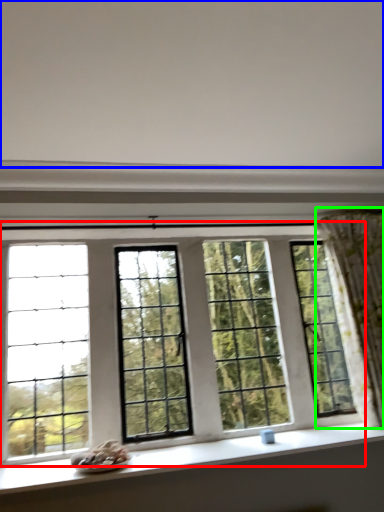
Question: Considering the real-world distances, which object is closest to window (highlighted by a red box)? backdrop (highlighted by a blue box) or curtain (highlighted by a green box).

Choices:
 (A) backdrop
 (B) curtain

Answer: (B)